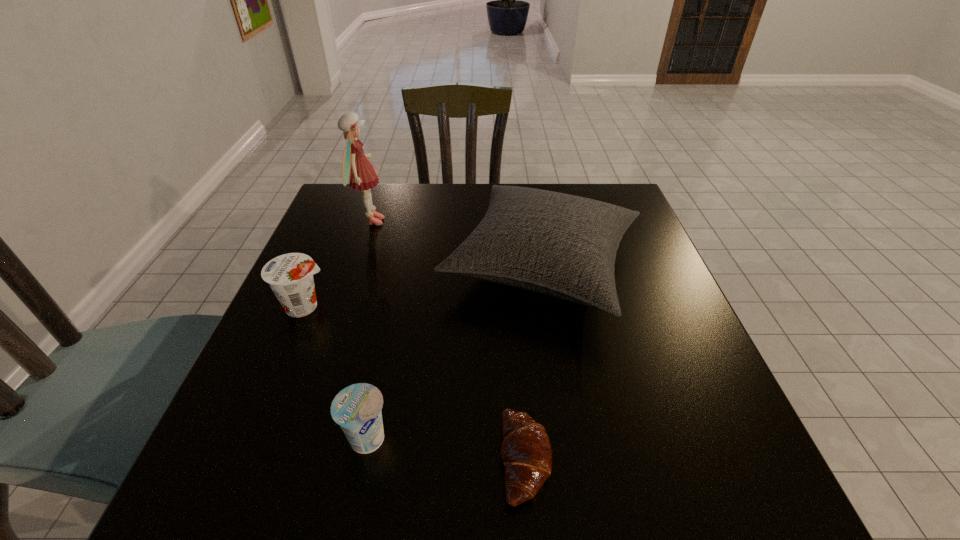
This screenshot has width=960, height=540. I want to click on vacant position in the image that satisfies the following two spatial constraints: 1. on the back side of the second tallest object; 2. on the front-facing side of the tallest object, so [535, 221].

The width and height of the screenshot is (960, 540). Identify the location of vacant space that satisfies the following two spatial constraints: 1. on the front-facing side of the second tallest object; 2. on the right side of the doll. (356, 266).

Find the location of a particular element. vacant point that satisfies the following two spatial constraints: 1. on the back side of the third object from right to left; 2. on the front-facing side of the tallest object is located at coordinates (413, 221).